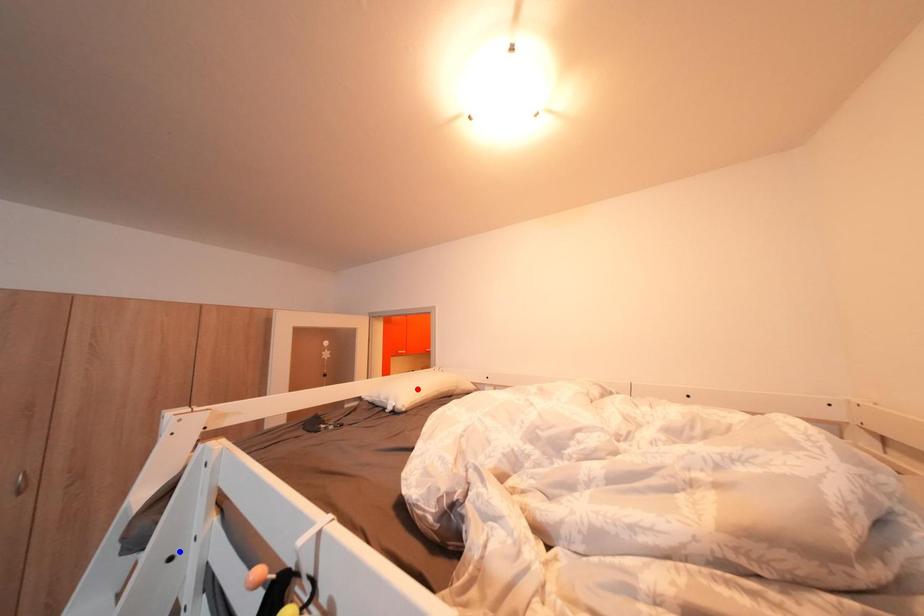
Question: In the image, two points are highlighted. Which point is nearer to the camera? Reply with the corresponding letter.

Choices:
 (A) blue point
 (B) red point

Answer: (A)